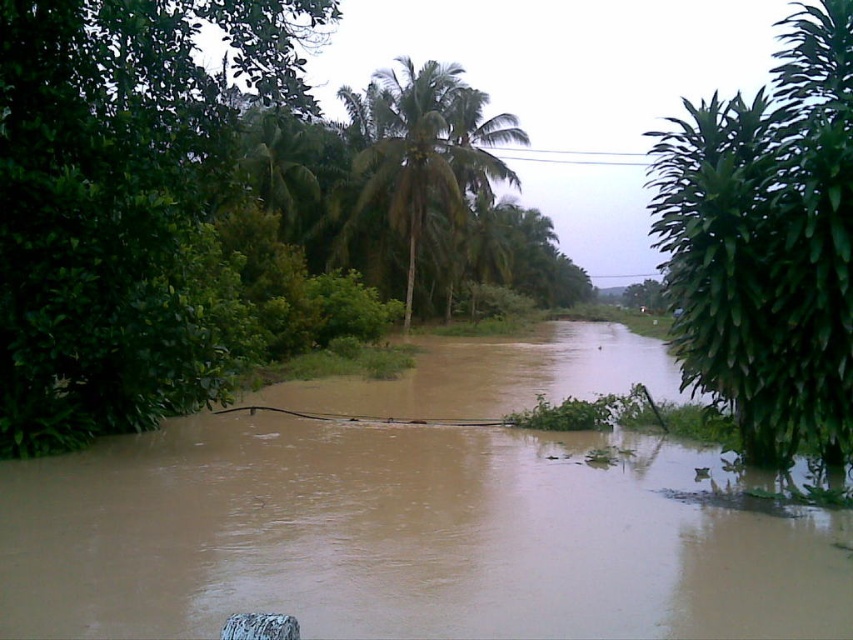
Question: Can you confirm if green leafy tree at left is positioned to the right of green leafy palm tree at center?

Choices:
 (A) yes
 (B) no

Answer: (B)

Question: Is brown muddy water at center smaller than green leafy palm tree at center?

Choices:
 (A) yes
 (B) no

Answer: (A)

Question: Is green leafy tree at left to the right of green leafy tree at right from the viewer's perspective?

Choices:
 (A) yes
 (B) no

Answer: (B)

Question: Which object is the closest to the green leafy tree at left?

Choices:
 (A) brown muddy water at center
 (B) green leafy tree at right

Answer: (A)

Question: Which of the following is the closest to the observer?

Choices:
 (A) (149, 358)
 (B) (780, 253)

Answer: (B)

Question: Which of these objects is positioned closest to the brown muddy water at center?

Choices:
 (A) green leafy tree at right
 (B) green leafy palm tree at center
 (C) green leafy tree at left

Answer: (C)